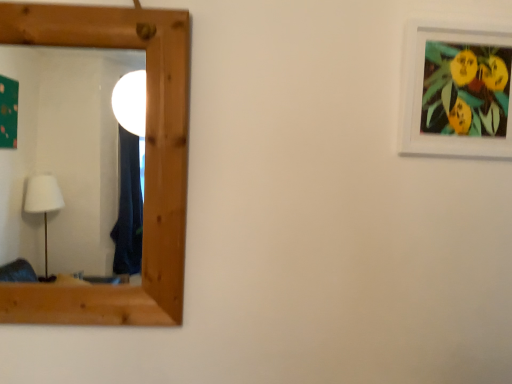
Question: Considering the relative positions of wooden mirror at left and white matte picture frame at upper right in the image provided, is wooden mirror at left to the left or to the right of white matte picture frame at upper right?

Choices:
 (A) right
 (B) left

Answer: (B)

Question: Considering the positions of point (40, 264) and point (446, 130), is point (40, 264) closer or farther from the camera than point (446, 130)?

Choices:
 (A) farther
 (B) closer

Answer: (A)

Question: In terms of width, does wooden mirror at left look wider or thinner when compared to white matte picture frame at upper right?

Choices:
 (A) thin
 (B) wide

Answer: (B)

Question: Looking at the image, does white matte picture frame at upper right seem bigger or smaller compared to wooden mirror at left?

Choices:
 (A) small
 (B) big

Answer: (A)

Question: From a real-world perspective, is white matte picture frame at upper right positioned above or below wooden mirror at left?

Choices:
 (A) above
 (B) below

Answer: (A)

Question: Is white matte picture frame at upper right inside or outside of wooden mirror at left?

Choices:
 (A) outside
 (B) inside

Answer: (A)

Question: Is point (501, 107) closer or farther from the camera than point (38, 162)?

Choices:
 (A) farther
 (B) closer

Answer: (B)